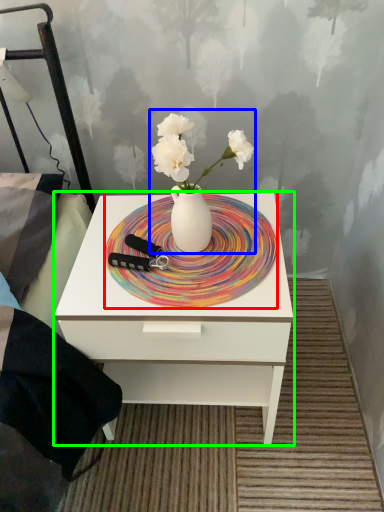
Question: Estimate the real-world distances between objects in this image. Which object is closer to plate (highlighted by a red box), floral arrangement (highlighted by a blue box) or nightstand (highlighted by a green box)?

Choices:
 (A) floral arrangement
 (B) nightstand

Answer: (A)